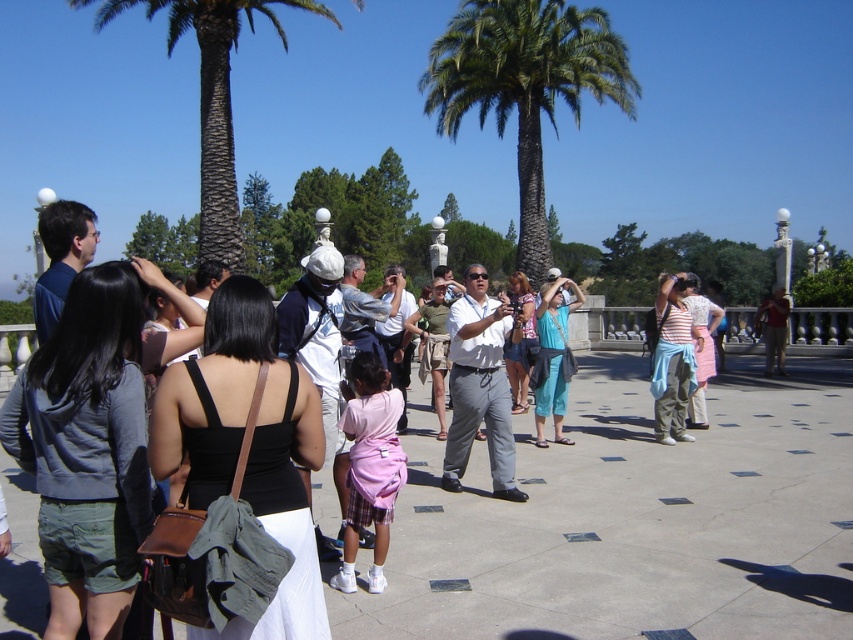
Question: Which of the following is the closest to the observer?

Choices:
 (A) matte red shirt at center
 (B) green leafy palm tree at upper center
 (C) white cotton shirt at center

Answer: (C)

Question: Which is nearer to the denim shorts at center?

Choices:
 (A) striped cotton shirt at center
 (B) matte red shirt at center

Answer: (A)

Question: Observing the image, what is the correct spatial positioning of matte gray hoodie at center left in reference to teal fabric pants at center?

Choices:
 (A) left
 (B) right

Answer: (A)

Question: Considering the relative positions of black fabric dress at center and khaki cotton shorts at center in the image provided, where is black fabric dress at center located with respect to khaki cotton shorts at center?

Choices:
 (A) left
 (B) right

Answer: (A)

Question: Which object is closer to the camera taking this photo?

Choices:
 (A) denim shorts at center
 (B) teal fabric pants at center
 (C) striped cotton shirt at center-right
 (D) green leafy palm tree at upper center

Answer: (A)

Question: Can you confirm if matte gray hoodie at center left is smaller than white cotton shirt at center?

Choices:
 (A) yes
 (B) no

Answer: (B)